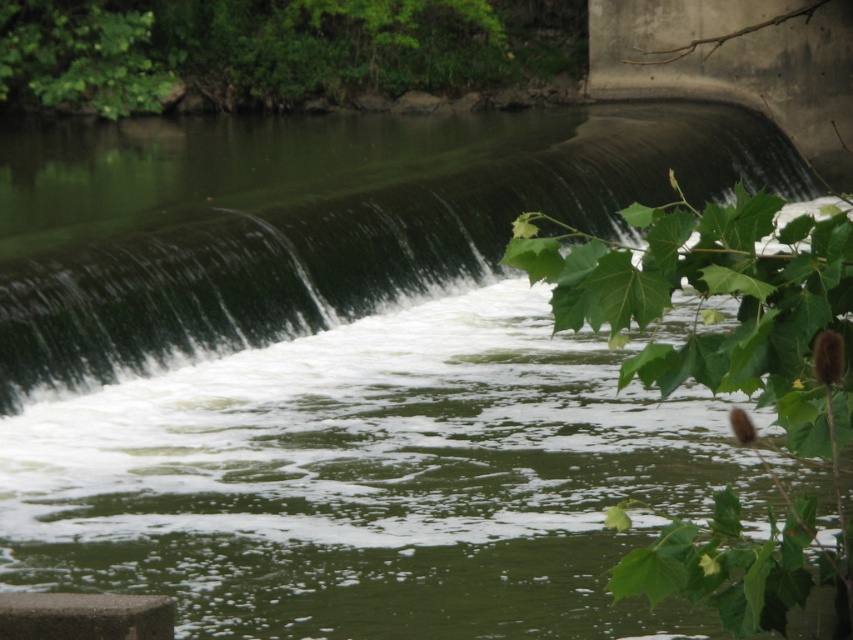
You are standing in front of the waterfall and want to take a photo of both the green smooth water at center and the green leafy plant at upper right. Which object should you adjust your camera to focus on first if you want to capture both in the same frame?

The green smooth water at center is positioned on the left side of green leafy plant at upper right, so you should focus on the green leafy plant at upper right first to ensure both are in the frame.

You are standing at the edge of the waterway and want to place a small floating toy boat exactly at the green smooth water at center. According to the coordinates provided, where should you aim to place the boat?

You should aim to place the boat at the coordinates point (311, 218) where the green smooth water at center is located.